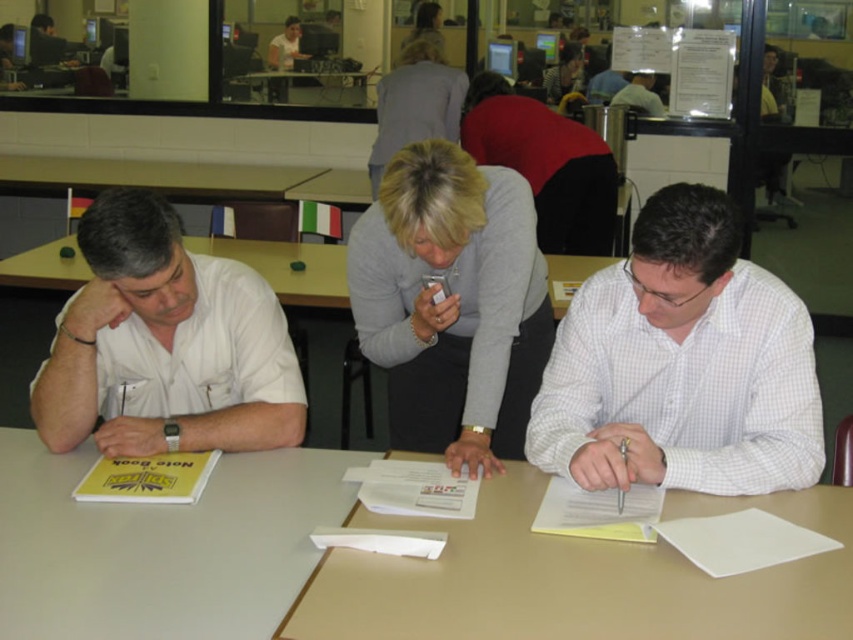
Is red fabric shirt at center wider than smooth gray shirt at center?

Yes, red fabric shirt at center is wider than smooth gray shirt at center.

Does point (514, 164) lie behind point (438, 19)?

No, (514, 164) is in front of (438, 19).

The image size is (853, 640). Find the location of `red fabric shirt at center`. red fabric shirt at center is located at coordinates (544, 164).

Between point (666, 326) and point (428, 38), which one is positioned in front?

Positioned in front is point (666, 326).

Is point (791, 337) behind point (436, 51)?

No, it is in front of (436, 51).

Which is in front, point (688, 349) or point (421, 45)?

Positioned in front is point (688, 349).

Locate an element on the screen. The height and width of the screenshot is (640, 853). white checkered shirt at right is located at coordinates (682, 364).

Which of these two, clear plastic table at center or smooth gray shirt at center, stands taller?

smooth gray shirt at center

Is clear plastic table at center closer to camera compared to smooth gray shirt at center?

No, it is not.

Does point (302, 88) come farther from viewer compared to point (415, 36)?

Yes.

Where is `clear plastic table at center`? clear plastic table at center is located at coordinates (300, 88).